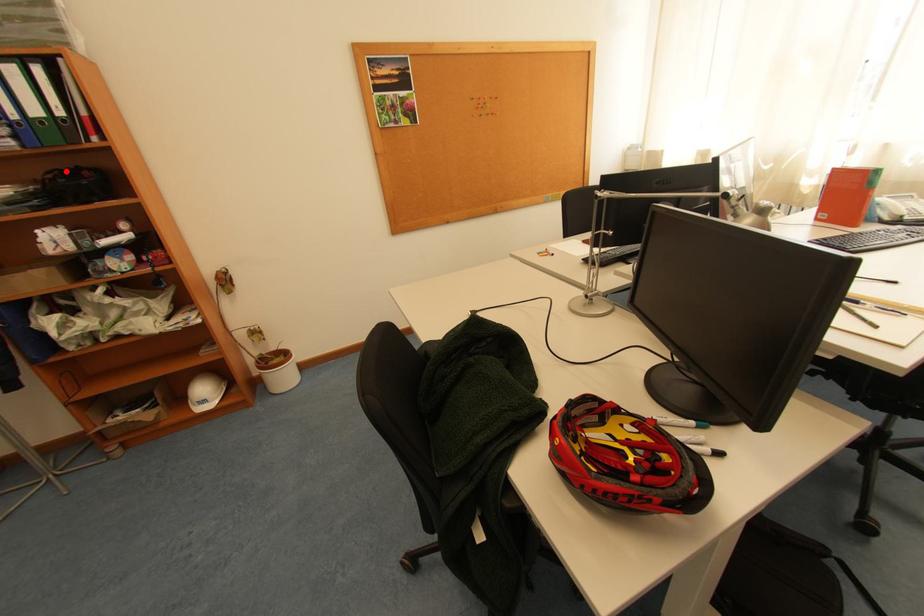
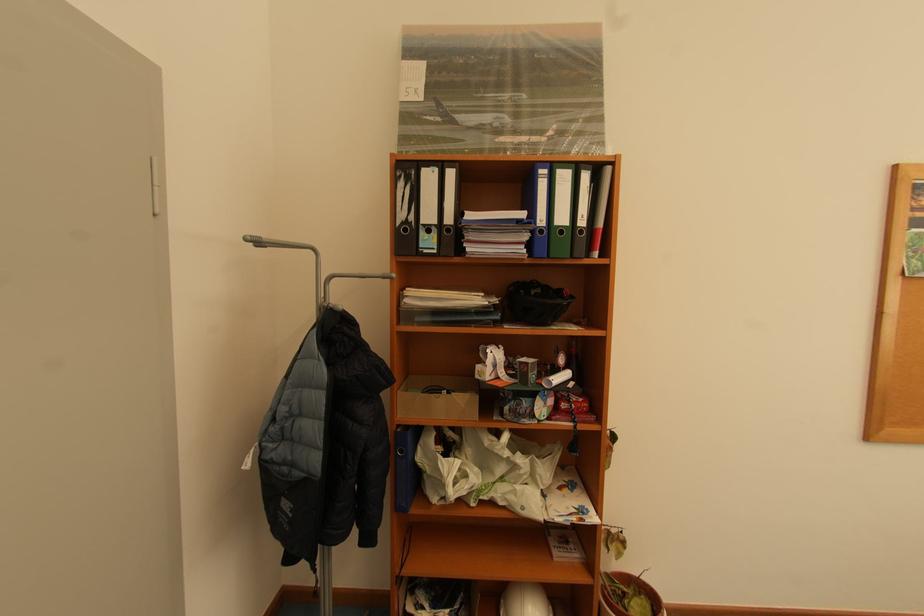
Find the pixel in the second image that matches the highlighted location in the first image.

(526, 284)